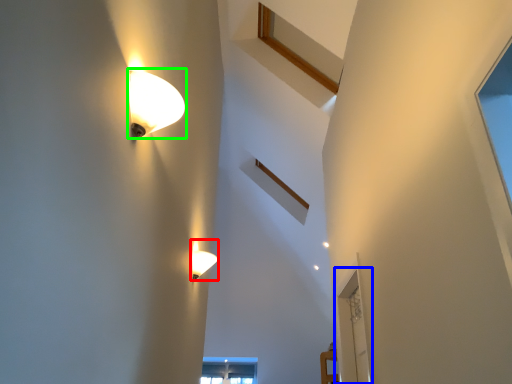
Question: Based on their relative distances, which object is nearer to lamp (highlighted by a red box)? Choose from glass door (highlighted by a blue box) and lamp (highlighted by a green box).

Choices:
 (A) glass door
 (B) lamp

Answer: (A)